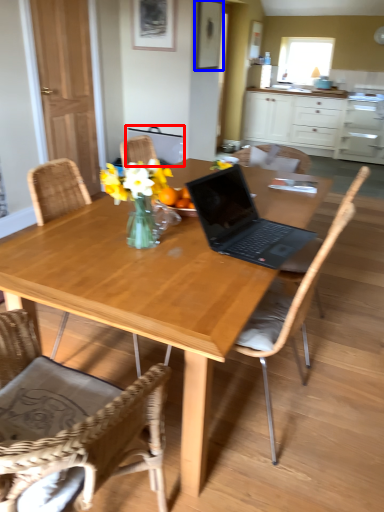
Question: Which of the following is the farthest to the observer, armchair (highlighted by a red box) or picture frame (highlighted by a blue box)?

Choices:
 (A) armchair
 (B) picture frame

Answer: (A)